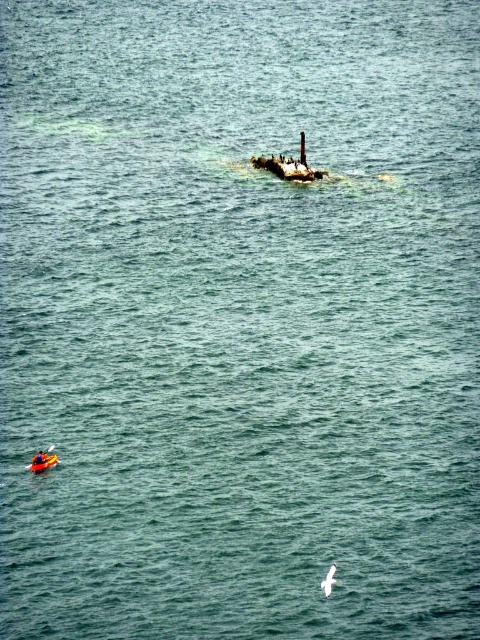
Question: Considering the relative positions of rusty metal shipwreck at center and white feathered bird at center in the image provided, where is rusty metal shipwreck at center located with respect to white feathered bird at center?

Choices:
 (A) above
 (B) below

Answer: (A)

Question: Can you confirm if rusty metal shipwreck at center is smaller than orange plastic kayak at center?

Choices:
 (A) yes
 (B) no

Answer: (A)

Question: Which point is farther to the camera?

Choices:
 (A) (282, 179)
 (B) (45, 461)

Answer: (A)

Question: From the image, what is the correct spatial relationship of rusty metal shipwreck at center in relation to white feathered bird at center?

Choices:
 (A) left
 (B) right

Answer: (A)

Question: Which point is farther to the camera?

Choices:
 (A) white feathered bird at center
 (B) orange plastic kayak at center
 (C) rusty metal shipwreck at center

Answer: (C)

Question: Which point is farther from the camera taking this photo?

Choices:
 (A) (324, 580)
 (B) (279, 168)

Answer: (B)